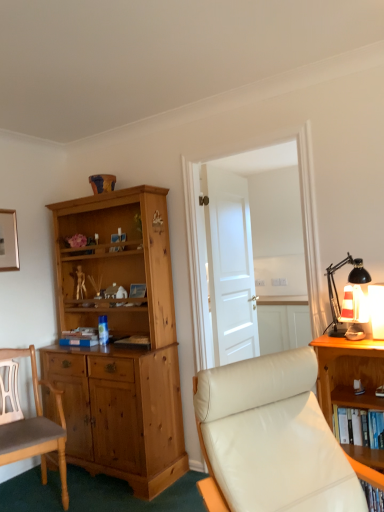
Question: Is striped fabric lampshade at right spatially inside white glossy door at center, or outside of it?

Choices:
 (A) inside
 (B) outside

Answer: (B)

Question: Is striped fabric lampshade at right to the left or to the right of white glossy door at center in the image?

Choices:
 (A) left
 (B) right

Answer: (B)

Question: Which of these objects is positioned farthest from the light brown wood chair at left, acting as the second chair starting from the right?

Choices:
 (A) striped fabric lampshade at right
 (B) hardcover book at center
 (C) white matte door at center
 (D) wooden bookshelf at right
 (E) white glossy door at center

Answer: (E)

Question: Estimate the real-world distances between objects in this image. Which object is farther from the striped fabric lampshade at right?

Choices:
 (A) white leather chair at center, the second chair from the left
 (B) light brown wood chair at left, the first chair positioned from the back
 (C) wooden bookshelf at right
 (D) white matte door at center
 (E) hardcover book at center

Answer: (B)